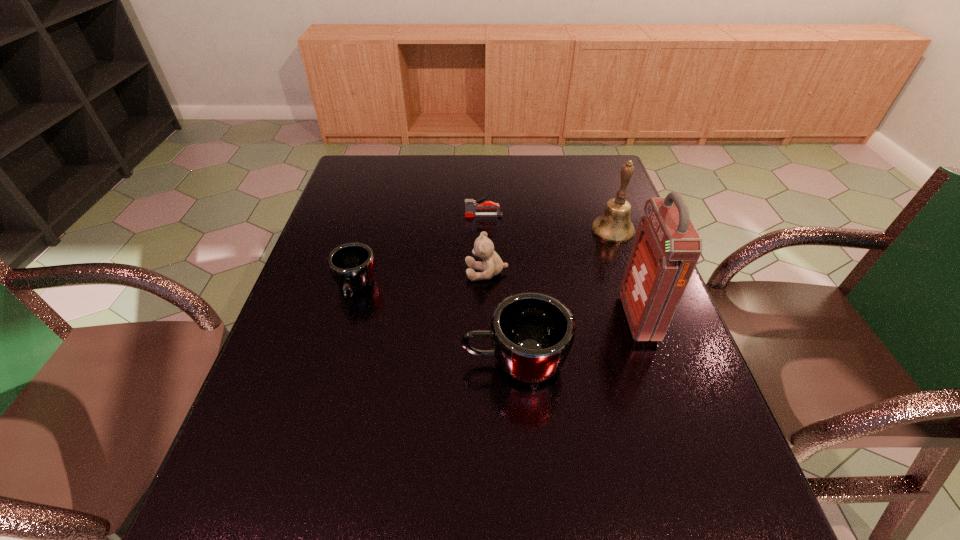
This screenshot has height=540, width=960. I want to click on the leftmost object, so click(352, 265).

Image resolution: width=960 pixels, height=540 pixels. What are the coordinates of `the farther mug` in the screenshot? It's located at (352, 265).

Find the location of `the taller mug`. the taller mug is located at coordinates (532, 333).

Locate an element on the screen. the third tallest object is located at coordinates (532, 333).

Identify the location of bell. The width and height of the screenshot is (960, 540). (614, 225).

Locate an element on the screen. This screenshot has width=960, height=540. stapler is located at coordinates click(471, 205).

Where is `the tallest object`? This screenshot has width=960, height=540. the tallest object is located at coordinates (667, 246).

This screenshot has height=540, width=960. Identify the location of teddy bear. (492, 264).

Locate an element on the screen. This screenshot has width=960, height=540. free space located on the side of the farther mug with the handle is located at coordinates (335, 359).

Locate an element on the screen. The height and width of the screenshot is (540, 960). blank area located on the side of the third tallest object with the handle is located at coordinates (384, 362).